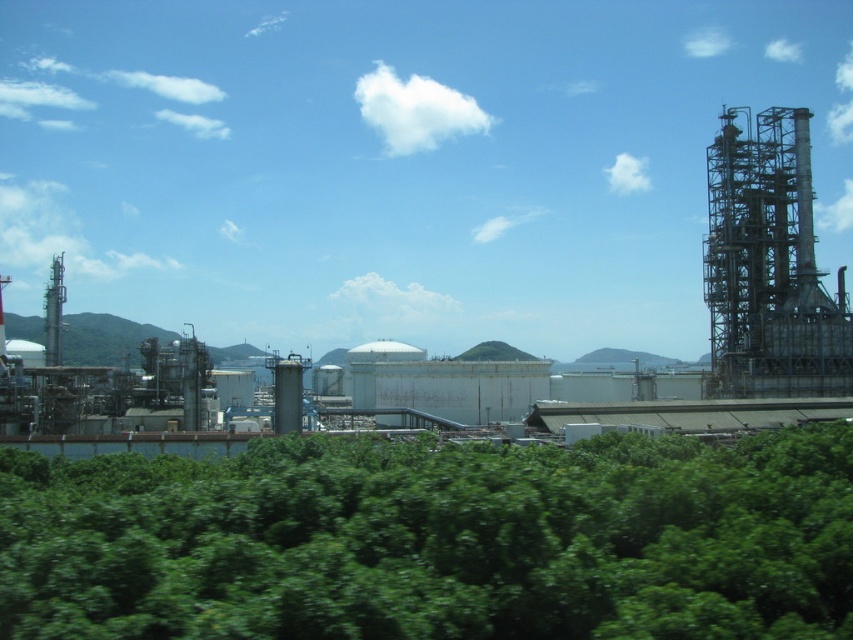
Who is shorter, green leafy trees at lower center or metallic gray structure at right?

Standing shorter between the two is green leafy trees at lower center.

Is green leafy trees at lower center to the left of metallic gray structure at right from the viewer's perspective?

Correct, you'll find green leafy trees at lower center to the left of metallic gray structure at right.

Between point (82, 518) and point (722, 264), which one is positioned in front?

Point (82, 518) is more forward.

Identify the location of green leafy trees at lower center. (434, 540).